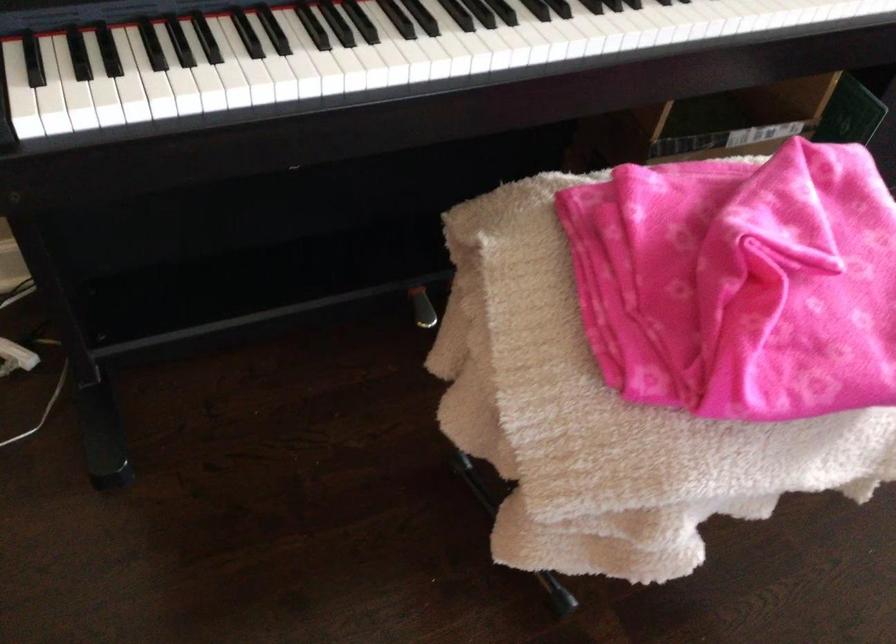
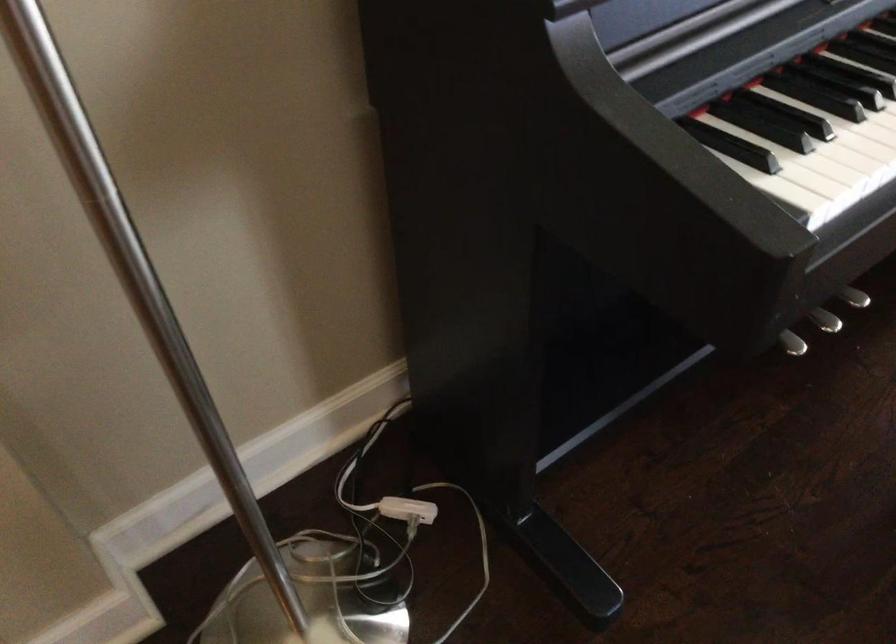
Where in the second image is the point corresponding to point 104,128 from the first image?

(851, 196)